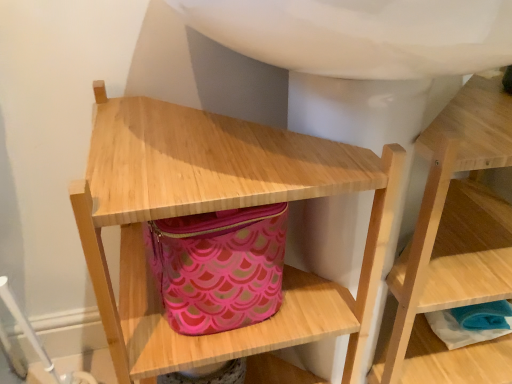
Question: Looking at the image, does pink fabric bag at center seem bigger or smaller compared to wooden shelf at center, positioned as the second shelf in left-to-right order?

Choices:
 (A) big
 (B) small

Answer: (B)

Question: From the image's perspective, is pink fabric bag at center located above or below wooden shelf at center, which appears as the first shelf when viewed from the right?

Choices:
 (A) below
 (B) above

Answer: (B)

Question: Which of these objects is positioned farthest from the natural wood shelf at center, which appears as the 2th shelf when viewed from the right?

Choices:
 (A) pink fabric bag at center
 (B) wooden shelf at center, positioned as the second shelf in left-to-right order

Answer: (B)

Question: Considering the real-world distances, which object is closest to the wooden shelf at center, positioned as the second shelf in left-to-right order?

Choices:
 (A) natural wood shelf at center, which appears as the 2th shelf when viewed from the right
 (B) pink fabric bag at center

Answer: (A)